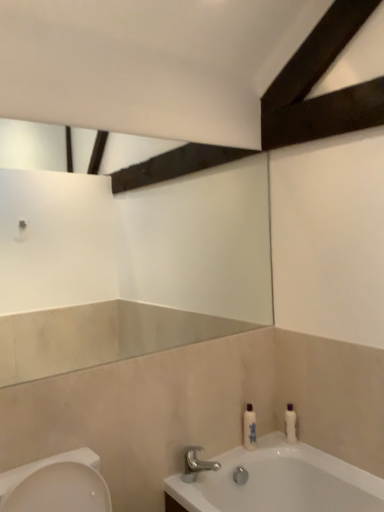
This screenshot has width=384, height=512. What do you see at coordinates (290, 424) in the screenshot?
I see `white glossy bottle at right, acting as the first toiletry starting from the right` at bounding box center [290, 424].

Locate an element on the screen. This screenshot has width=384, height=512. polished chrome faucet at lower center is located at coordinates (196, 464).

Which is in front, point (285, 415) or point (251, 426)?

The point (251, 426) is more forward.

From a real-world perspective, relative to white glossy bottle at lower right, positioned as the 2th toiletry in right-to-left order, is white glossy bottle at right, arranged as the 2th toiletry when viewed from the left, vertically above or below?

white glossy bottle at right, arranged as the 2th toiletry when viewed from the left, is situated lower than white glossy bottle at lower right, positioned as the 2th toiletry in right-to-left order, in the real world.

Which is behind, white glossy bottle at right, acting as the first toiletry starting from the right, or white glossy bottle at lower right, the first toiletry viewed from the left?

white glossy bottle at right, acting as the first toiletry starting from the right, is further away from the camera.

Is white glossy bottle at lower right, the first toiletry viewed from the left, smaller than white glossy bottle at right, arranged as the 2th toiletry when viewed from the left?

No.

From the image's perspective, is white glossy bottle at lower right, the first toiletry viewed from the left, above or below white glossy bottle at right, arranged as the 2th toiletry when viewed from the left?

From the image's perspective, white glossy bottle at lower right, the first toiletry viewed from the left, appears above white glossy bottle at right, arranged as the 2th toiletry when viewed from the left.

Locate an element on the screen. toiletry below the white glossy bottle at lower right, positioned as the 2th toiletry in right-to-left order (from a real-world perspective) is located at coordinates (290, 424).

From a real-world perspective, is polished chrome faucet at lower center positioned under white glossy bottle at lower right, positioned as the 2th toiletry in right-to-left order, based on gravity?

Yes.

In the scene shown: Is polished chrome faucet at lower center inside the boundaries of white glossy bottle at lower right, positioned as the 2th toiletry in right-to-left order, or outside?

The correct answer is: outside.

Locate an element on the screen. the 1st toiletry behind the polished chrome faucet at lower center, starting your count from the anchor is located at coordinates (249, 428).

Is polished chrome faucet at lower center facing away from white glossy bottle at right, acting as the first toiletry starting from the right?

No, polished chrome faucet at lower center's orientation is not away from white glossy bottle at right, acting as the first toiletry starting from the right.

Who is taller, polished chrome faucet at lower center or white glossy bottle at right, acting as the first toiletry starting from the right?

white glossy bottle at right, acting as the first toiletry starting from the right.

From the image's perspective, is polished chrome faucet at lower center above or below white glossy bottle at right, arranged as the 2th toiletry when viewed from the left?

Clearly, from the image's perspective, polished chrome faucet at lower center is below white glossy bottle at right, arranged as the 2th toiletry when viewed from the left.

Where is `tap below the white glossy bottle at right, acting as the first toiletry starting from the right (from the image's perspective)`? tap below the white glossy bottle at right, acting as the first toiletry starting from the right (from the image's perspective) is located at coordinates (196, 464).

Which point is more distant from viewer, (286, 433) or (192, 452)?

Positioned behind is point (286, 433).

Consider the image. From a real-world perspective, is white glossy bottle at right, acting as the first toiletry starting from the right, over polished chrome faucet at lower center?

Yes, from a real-world perspective, white glossy bottle at right, acting as the first toiletry starting from the right, is above polished chrome faucet at lower center.

Considering the relative positions of white glossy bottle at right, acting as the first toiletry starting from the right, and polished chrome faucet at lower center in the image provided, is white glossy bottle at right, acting as the first toiletry starting from the right, to the left or to the right of polished chrome faucet at lower center?

white glossy bottle at right, acting as the first toiletry starting from the right, is positioned on polished chrome faucet at lower center's right side.

Can you confirm if white glossy bottle at lower right, the first toiletry viewed from the left, is shorter than polished chrome faucet at lower center?

Incorrect, the height of white glossy bottle at lower right, the first toiletry viewed from the left, does not fall short of that of polished chrome faucet at lower center.

Is polished chrome faucet at lower center a part of white glossy bottle at lower right, positioned as the 2th toiletry in right-to-left order?

No, polished chrome faucet at lower center is not a part of white glossy bottle at lower right, positioned as the 2th toiletry in right-to-left order.

Is white glossy bottle at lower right, the first toiletry viewed from the left, turned away from polished chrome faucet at lower center?

white glossy bottle at lower right, the first toiletry viewed from the left, is not turned away from polished chrome faucet at lower center.

From the image's perspective, is white glossy bottle at lower right, positioned as the 2th toiletry in right-to-left order, under polished chrome faucet at lower center?

No, from the image's perspective, white glossy bottle at lower right, positioned as the 2th toiletry in right-to-left order, is not below polished chrome faucet at lower center.

Find the location of a particular element. This screenshot has height=512, width=384. toiletry in front of the white glossy bottle at right, arranged as the 2th toiletry when viewed from the left is located at coordinates (249, 428).

What are the coordinates of `toiletry above the white glossy bottle at right, arranged as the 2th toiletry when viewed from the left (from the image's perspective)` in the screenshot? It's located at (249, 428).

Estimate the real-world distances between objects in this image. Which object is further from white glossy bottle at lower right, the first toiletry viewed from the left, white glossy bottle at right, arranged as the 2th toiletry when viewed from the left, or polished chrome faucet at lower center?

polished chrome faucet at lower center is further to white glossy bottle at lower right, the first toiletry viewed from the left.

Estimate the real-world distances between objects in this image. Which object is closer to polished chrome faucet at lower center, white glossy bottle at right, acting as the first toiletry starting from the right, or white glossy bottle at lower right, positioned as the 2th toiletry in right-to-left order?

white glossy bottle at lower right, positioned as the 2th toiletry in right-to-left order, is closer to polished chrome faucet at lower center.

Based on their spatial positions, is white glossy bottle at lower right, the first toiletry viewed from the left, or polished chrome faucet at lower center further from white glossy bottle at right, acting as the first toiletry starting from the right?

polished chrome faucet at lower center lies further to white glossy bottle at right, acting as the first toiletry starting from the right, than the other object.

From the image, which object appears to be farther from polished chrome faucet at lower center, white glossy bottle at lower right, the first toiletry viewed from the left, or white glossy bottle at right, arranged as the 2th toiletry when viewed from the left?

Based on the image, white glossy bottle at right, arranged as the 2th toiletry when viewed from the left, appears to be further to polished chrome faucet at lower center.

When comparing their distances from white glossy bottle at right, arranged as the 2th toiletry when viewed from the left, does polished chrome faucet at lower center or white glossy bottle at lower right, the first toiletry viewed from the left, seem closer?

white glossy bottle at lower right, the first toiletry viewed from the left, is closer to white glossy bottle at right, arranged as the 2th toiletry when viewed from the left.

From the image, which object appears to be nearer to white glossy bottle at lower right, positioned as the 2th toiletry in right-to-left order, polished chrome faucet at lower center or white glossy bottle at right, arranged as the 2th toiletry when viewed from the left?

white glossy bottle at right, arranged as the 2th toiletry when viewed from the left, is closer to white glossy bottle at lower right, positioned as the 2th toiletry in right-to-left order.

Where is `toiletry located between polished chrome faucet at lower center and white glossy bottle at right, acting as the first toiletry starting from the right, in the left-right direction`? The image size is (384, 512). toiletry located between polished chrome faucet at lower center and white glossy bottle at right, acting as the first toiletry starting from the right, in the left-right direction is located at coordinates (249, 428).